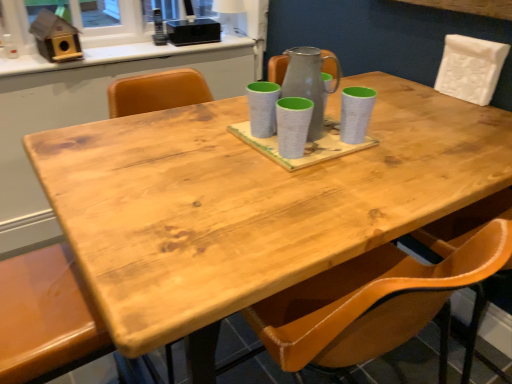
This screenshot has width=512, height=384. In order to click on vacant space in front of white matte chair at upper right, which is the second chair in left-to-right order in this screenshot , I will do `click(470, 118)`.